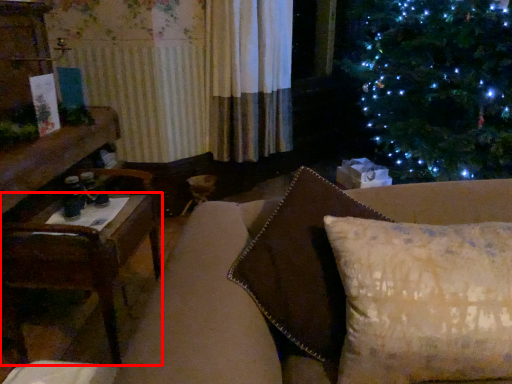
Question: From the image's perspective, what is the correct spatial relationship of table (annotated by the red box) in relation to pillow?

Choices:
 (A) above
 (B) below

Answer: (B)